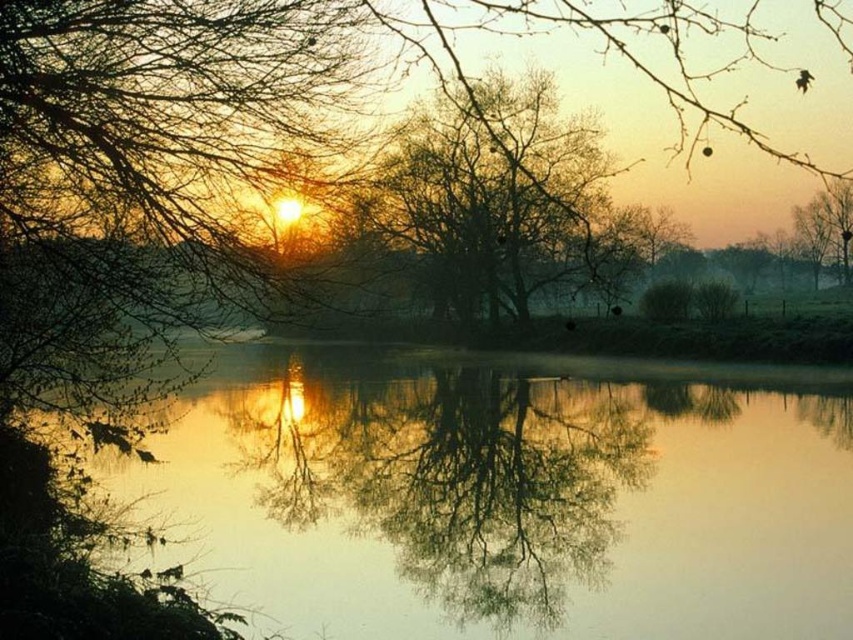
You are standing at the edge of the water and see the point marked as point (x=503, y=496) in the image. Where is this point located?

The point (x=503, y=496) is on silvery reflective water at center.

Based on the photo, you are an artist trying to paint the sunset scene. You notice the silvery reflective water at center and the bare branches at center. Which object in the scene is wider?

The silvery reflective water at center is wider than the bare branches at center.

You are standing at the center of the image and want to find the silvery reflective water at center. According to the coordinates provided, in which direction should you look to locate it?

The silvery reflective water at center is located at coordinates point (503,496), which means you should look slightly to the right and downward from the center to find it.